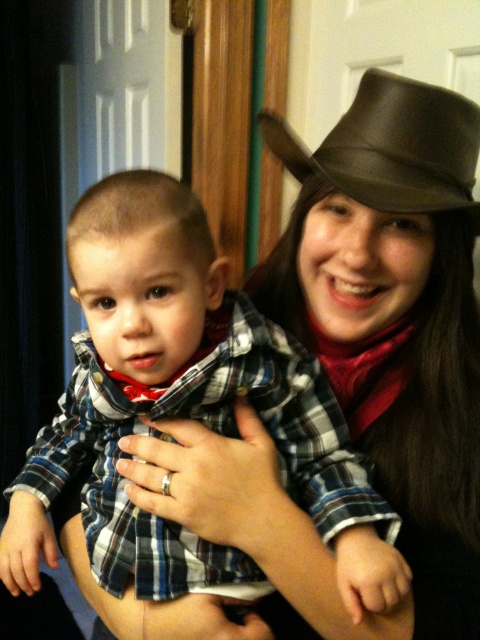
Question: Which object appears farthest from the camera in this image?

Choices:
 (A) brown leather fedora at upper right
 (B) plaid fabric shirt at center

Answer: (A)

Question: Is plaid fabric shirt at center to the right of brown leather fedora at upper right from the viewer's perspective?

Choices:
 (A) yes
 (B) no

Answer: (B)

Question: Is plaid fabric shirt at center smaller than brown leather fedora at upper right?

Choices:
 (A) no
 (B) yes

Answer: (A)

Question: Where is plaid fabric shirt at center located in relation to brown leather fedora at upper right in the image?

Choices:
 (A) right
 (B) left

Answer: (B)